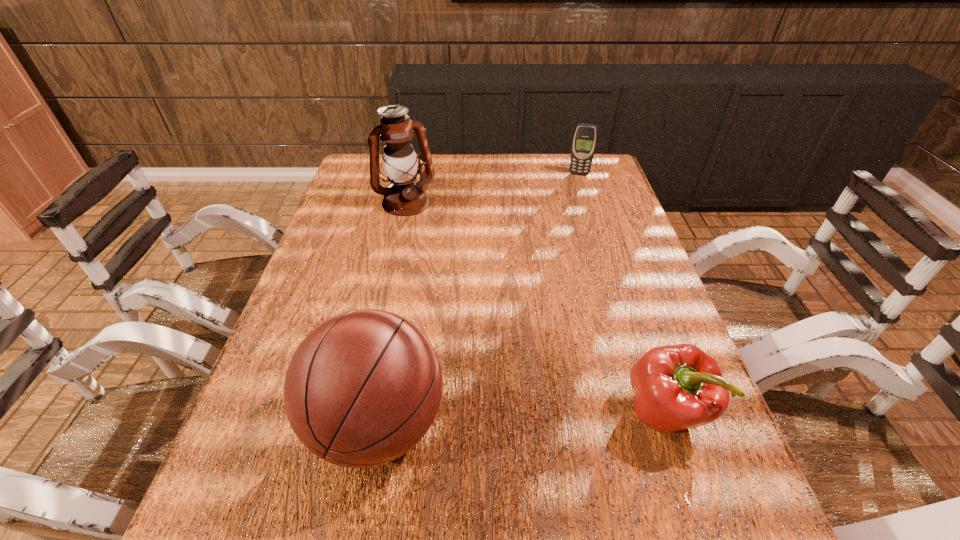
Find the location of a particular element. vacant space on the desktop that is between the third shortest object and the pepper and is positioned on the screen of the farthest object is located at coordinates (542, 417).

Find the location of a particular element. Image resolution: width=960 pixels, height=540 pixels. free space on the desktop that is between the basketball and the pepper and is positioned on the side of the tallest object, there is a wick adjustment knob is located at coordinates (514, 418).